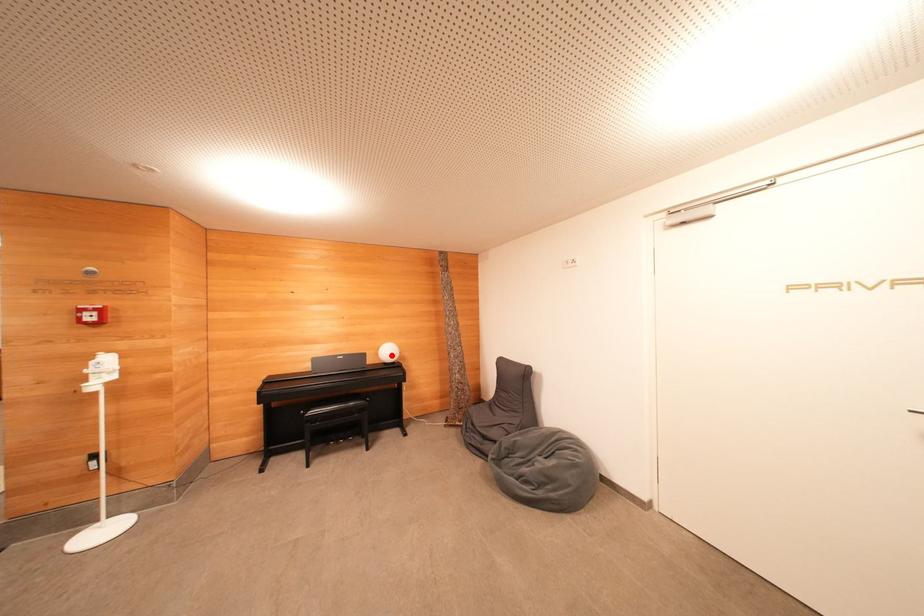
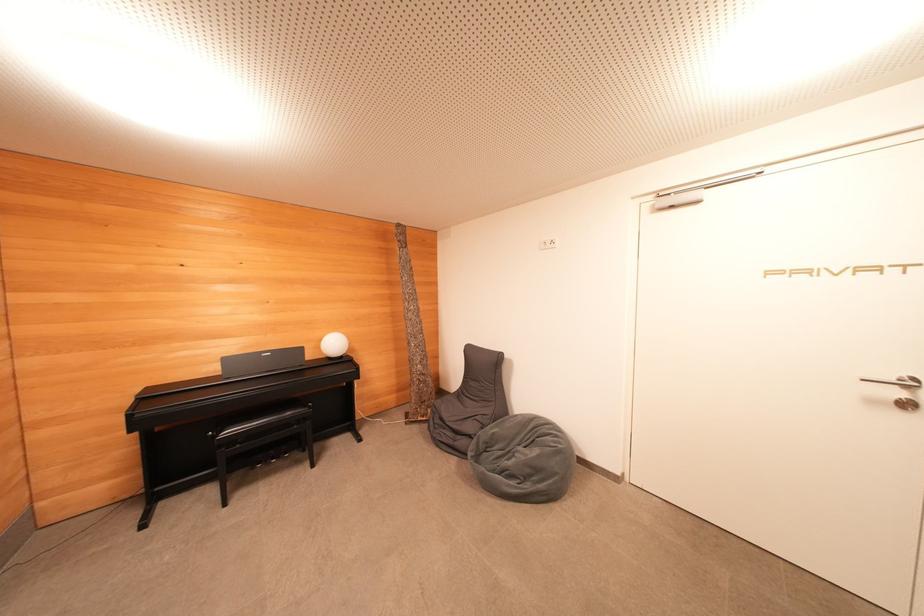
Where in the second image is the point corresponding to the highlighted location from the first image?

(337, 347)